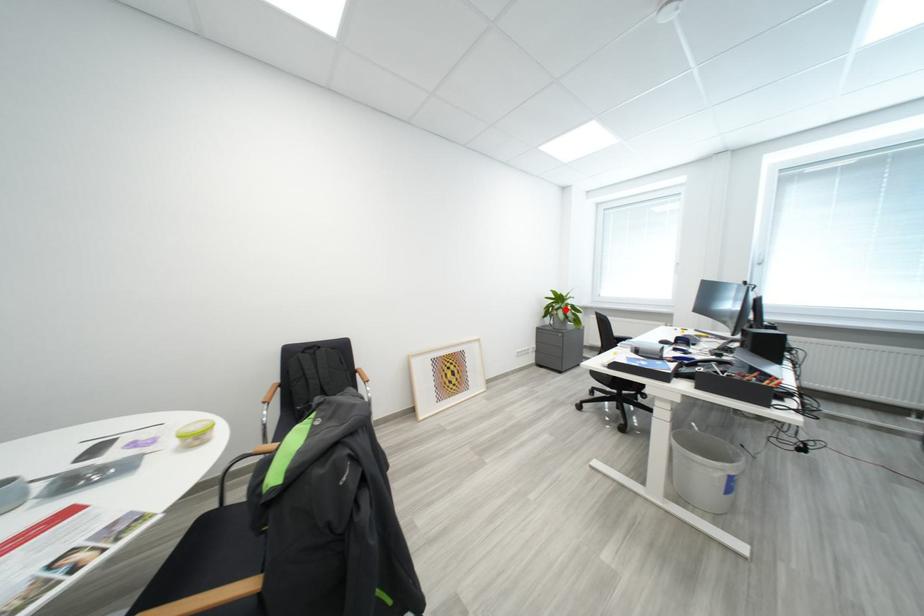
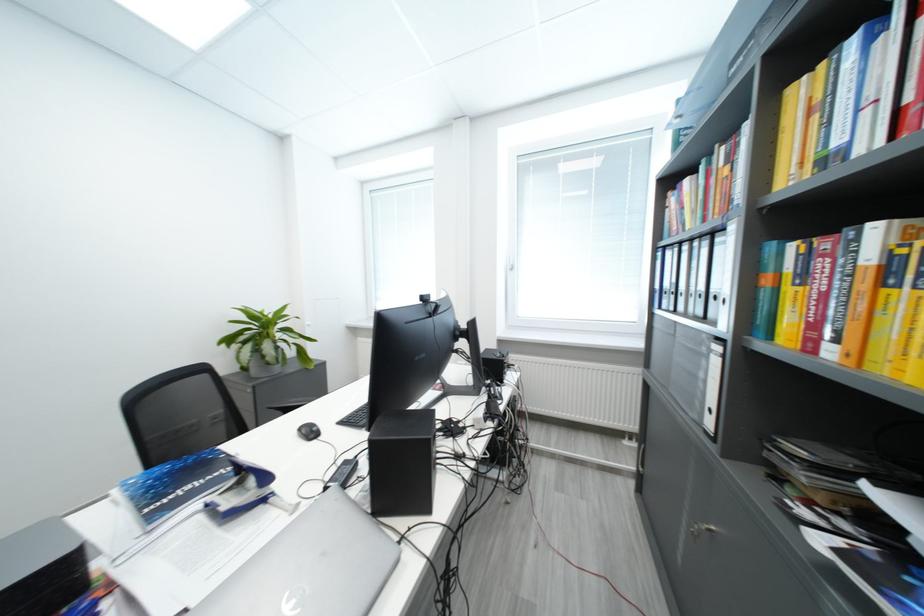
The point at the highlighted location is marked in the first image. Where is the corresponding point in the second image?

(251, 341)